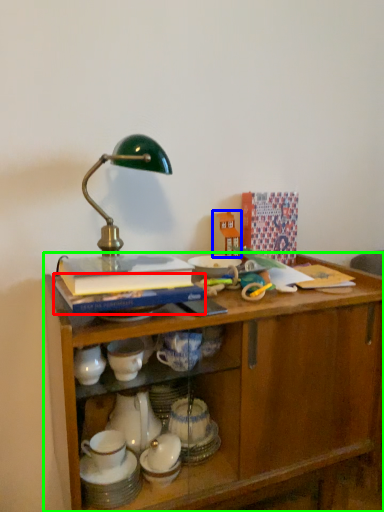
Question: Estimate the real-world distances between objects in this image. Which object is farther from book (highlighted by a red box), toy (highlighted by a blue box) or desk (highlighted by a green box)?

Choices:
 (A) toy
 (B) desk

Answer: (A)